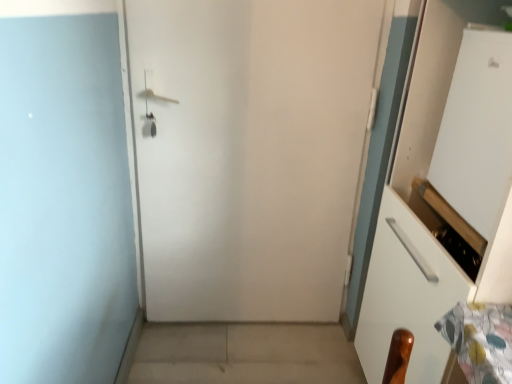
Question: From the image's perspective, is white glossy screen door at upper right located beneath white matte door at center?

Choices:
 (A) yes
 (B) no

Answer: (B)

Question: Is the position of white glossy screen door at upper right less distant than that of white matte door at center?

Choices:
 (A) no
 (B) yes

Answer: (B)

Question: Can you confirm if white glossy screen door at upper right is positioned to the left of white matte door at center?

Choices:
 (A) no
 (B) yes

Answer: (A)

Question: From the image's perspective, is white glossy screen door at upper right over white matte door at center?

Choices:
 (A) no
 (B) yes

Answer: (B)

Question: From a real-world perspective, is white glossy screen door at upper right over white matte door at center?

Choices:
 (A) no
 (B) yes

Answer: (B)

Question: Considering the positions of beige concrete at lower center and white glossy screen door at upper right in the image, is beige concrete at lower center wider or thinner than white glossy screen door at upper right?

Choices:
 (A) thin
 (B) wide

Answer: (B)

Question: In the image, is beige concrete at lower center positioned in front of or behind white glossy screen door at upper right?

Choices:
 (A) behind
 (B) front

Answer: (A)

Question: Considering the positions of point (181, 344) and point (486, 206), is point (181, 344) closer or farther from the camera than point (486, 206)?

Choices:
 (A) farther
 (B) closer

Answer: (A)

Question: Considering the positions of beige concrete at lower center and white glossy screen door at upper right in the image, is beige concrete at lower center bigger or smaller than white glossy screen door at upper right?

Choices:
 (A) small
 (B) big

Answer: (A)

Question: Would you say white matte door at center is inside or outside beige concrete at lower center?

Choices:
 (A) inside
 (B) outside

Answer: (B)

Question: In terms of size, does white matte door at center appear bigger or smaller than beige concrete at lower center?

Choices:
 (A) big
 (B) small

Answer: (A)

Question: Is white matte door at center wider or thinner than beige concrete at lower center?

Choices:
 (A) wide
 (B) thin

Answer: (B)

Question: From a real-world perspective, is white matte door at center above or below beige concrete at lower center?

Choices:
 (A) above
 (B) below

Answer: (A)

Question: From a real-world perspective, is white glossy screen door at upper right positioned above or below beige concrete at lower center?

Choices:
 (A) above
 (B) below

Answer: (A)

Question: Is white glossy screen door at upper right wider or thinner than beige concrete at lower center?

Choices:
 (A) wide
 (B) thin

Answer: (B)